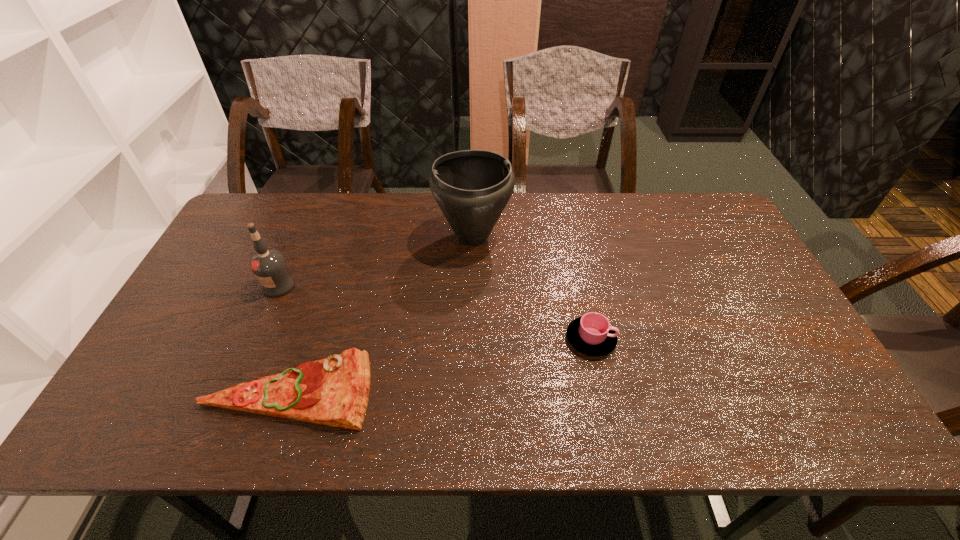
Where is `vacant space located 0.270m on the back of the shortest object`? vacant space located 0.270m on the back of the shortest object is located at coordinates (327, 275).

Identify the location of object at the far edge. (472, 187).

At what (x,y) coordinates should I click in order to perform the action: click on object that is at the near edge. Please return your answer as a coordinate pair (x, y). Image resolution: width=960 pixels, height=540 pixels. Looking at the image, I should click on (334, 391).

This screenshot has height=540, width=960. Find the location of `vacant point at the far edge`. vacant point at the far edge is located at coordinates (306, 232).

In the image, there is a desktop. Find the location of `vacant space at the right edge`. vacant space at the right edge is located at coordinates (728, 278).

Identify the location of vacant area at the far right corner. (732, 238).

Where is `vacant area that lies between the urn and the third nearest object`? The width and height of the screenshot is (960, 540). vacant area that lies between the urn and the third nearest object is located at coordinates (376, 261).

Locate an element on the screen. vacant space that is in between the pizza and the third shortest object is located at coordinates (284, 338).

I want to click on blank region between the cup and the third shortest object, so click(x=435, y=313).

Locate an element on the screen. vacant space that is in between the second shortest object and the pizza is located at coordinates (440, 364).